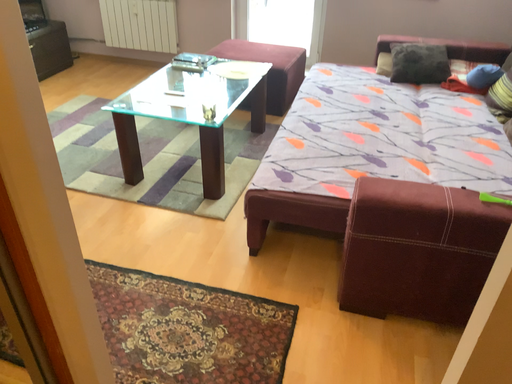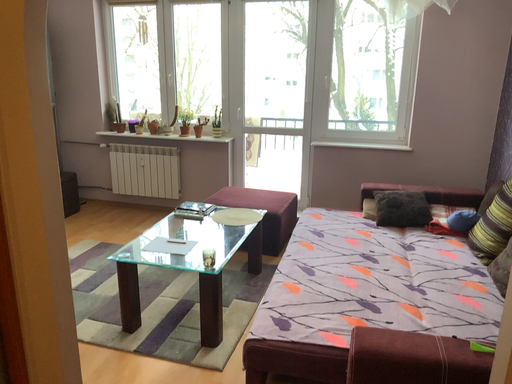
Question: How did the camera likely rotate when shooting the video?

Choices:
 (A) rotated upward
 (B) rotated downward

Answer: (A)